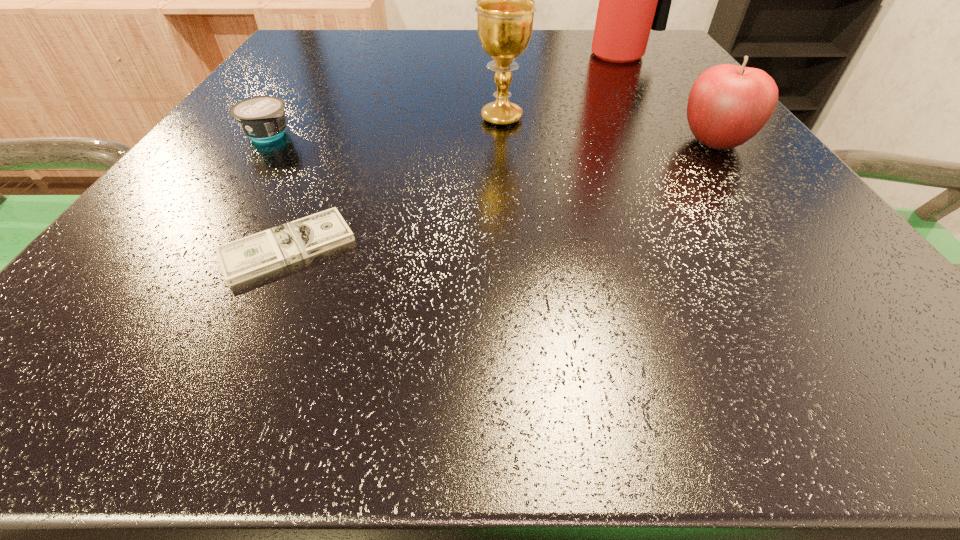
The width and height of the screenshot is (960, 540). Find the location of `free region located on the left of the apple`. free region located on the left of the apple is located at coordinates (531, 142).

Where is `vacant area situated on the back of the fourth tallest object`? This screenshot has width=960, height=540. vacant area situated on the back of the fourth tallest object is located at coordinates (334, 38).

Find the location of a particular element. This screenshot has height=540, width=960. free spot located on the right of the dollar is located at coordinates (415, 247).

Locate an element on the screen. The width and height of the screenshot is (960, 540). object that is positioned at the far edge is located at coordinates (633, 0).

I want to click on yogurt present at the left edge, so click(262, 118).

At what (x,y) coordinates should I click in order to perform the action: click on dollar that is at the left edge. Please return your answer as a coordinate pair (x, y). The height and width of the screenshot is (540, 960). Looking at the image, I should click on (254, 255).

At what (x,y) coordinates should I click in order to perform the action: click on fire extinguisher that is at the right edge. Please return your answer as a coordinate pair (x, y). Looking at the image, I should click on (633, 0).

Locate an element on the screen. The image size is (960, 540). apple located at the right edge is located at coordinates (728, 105).

Identify the location of object situated at the far right corner. The width and height of the screenshot is (960, 540). (633, 0).

Find the location of a particular element. The height and width of the screenshot is (540, 960). vacant space at the far edge is located at coordinates pos(468,35).